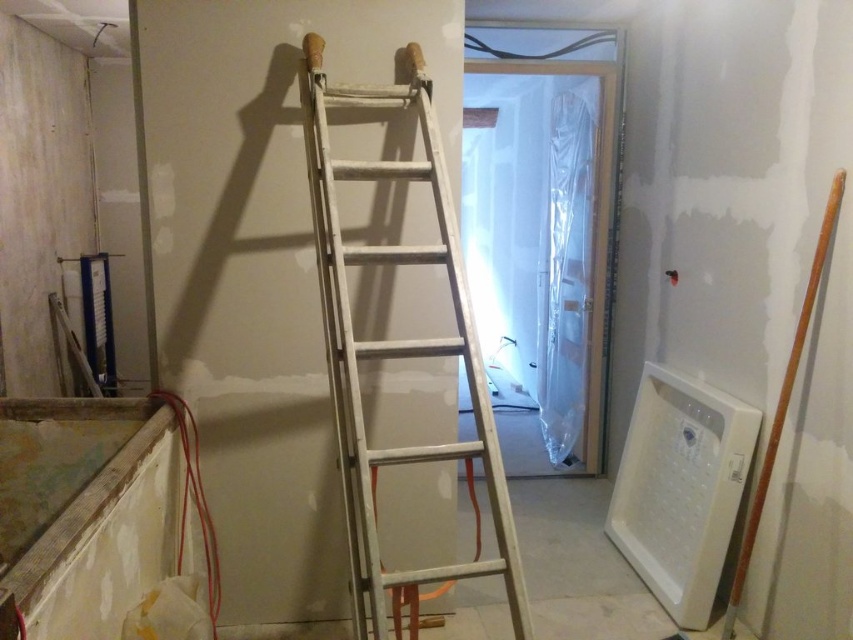
Question: Among these objects, which one is farthest from the camera?

Choices:
 (A) metallic silver ladder at upper center
 (B) white wooden ladder at center

Answer: (A)

Question: Does white wooden ladder at center have a larger size compared to metallic silver ladder at upper center?

Choices:
 (A) yes
 (B) no

Answer: (A)

Question: Is white wooden ladder at center thinner than metallic silver ladder at upper center?

Choices:
 (A) no
 (B) yes

Answer: (A)

Question: Considering the relative positions of white wooden ladder at center and metallic silver ladder at upper center in the image provided, where is white wooden ladder at center located with respect to metallic silver ladder at upper center?

Choices:
 (A) below
 (B) above

Answer: (A)

Question: Which point is farther from the camera taking this photo?

Choices:
 (A) tap(329, 164)
 (B) tap(322, 45)

Answer: (B)